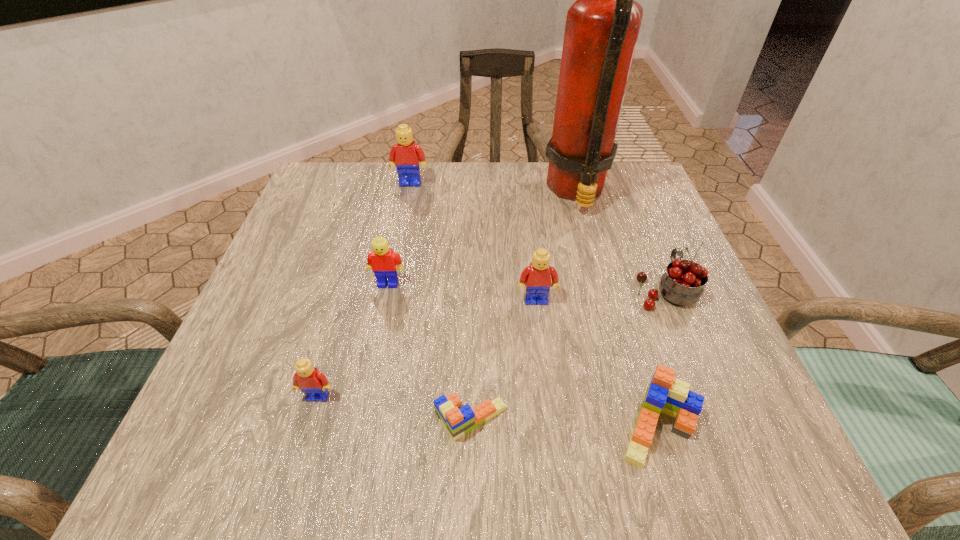
I want to click on free point that satisfies the following two spatial constraints: 1. on the handle side of the red cherry; 2. at the nozzle of the red fire extinguisher, so click(626, 192).